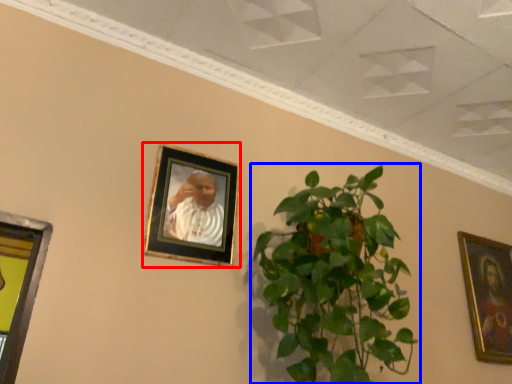
Question: Among these objects, which one is nearest to the camera, picture frame (highlighted by a red box) or houseplant (highlighted by a blue box)?

Choices:
 (A) picture frame
 (B) houseplant

Answer: (B)